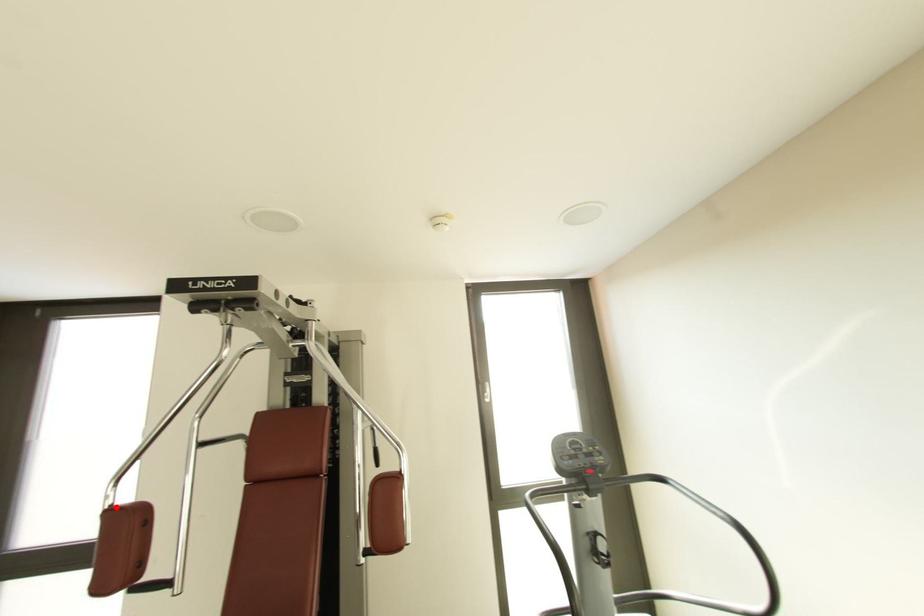
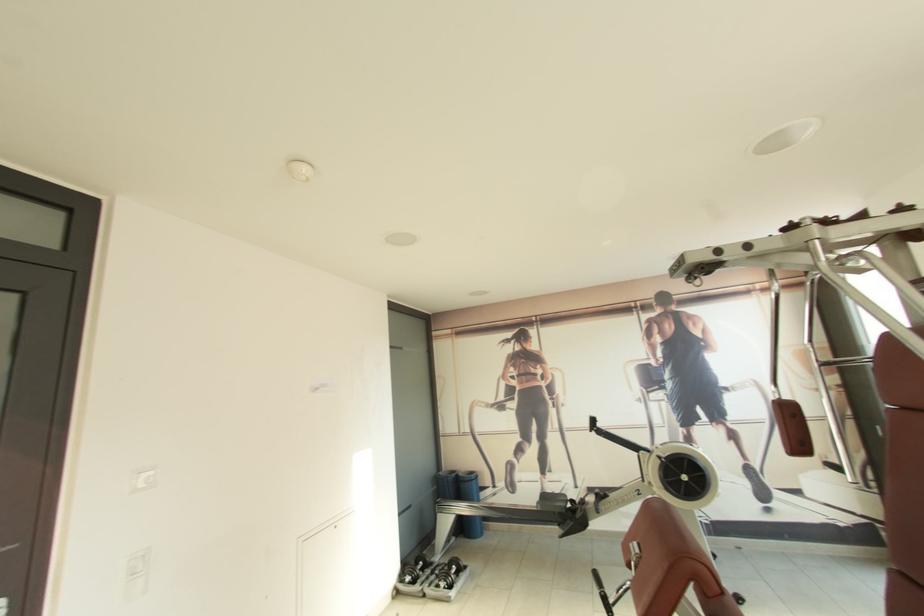
The point at the highlighted location is marked in the first image. Where is the corresponding point in the second image?

(784, 400)